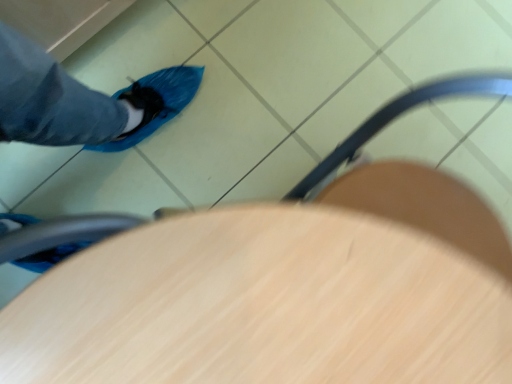
What do you see at coordinates (255, 302) in the screenshot? The height and width of the screenshot is (384, 512). I see `wooden table at lower center` at bounding box center [255, 302].

Locate an element on the screen. wooden table at lower center is located at coordinates (255, 302).

At what (x,y) coordinates should I click in order to perform the action: click on wooden table at lower center. Please return your answer as a coordinate pair (x, y). The image size is (512, 384). Looking at the image, I should click on (255, 302).